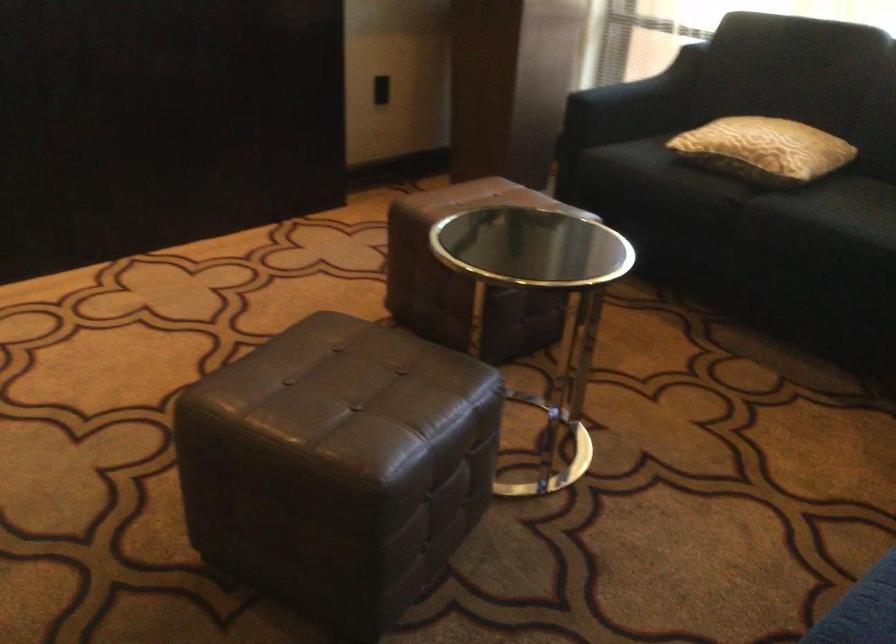
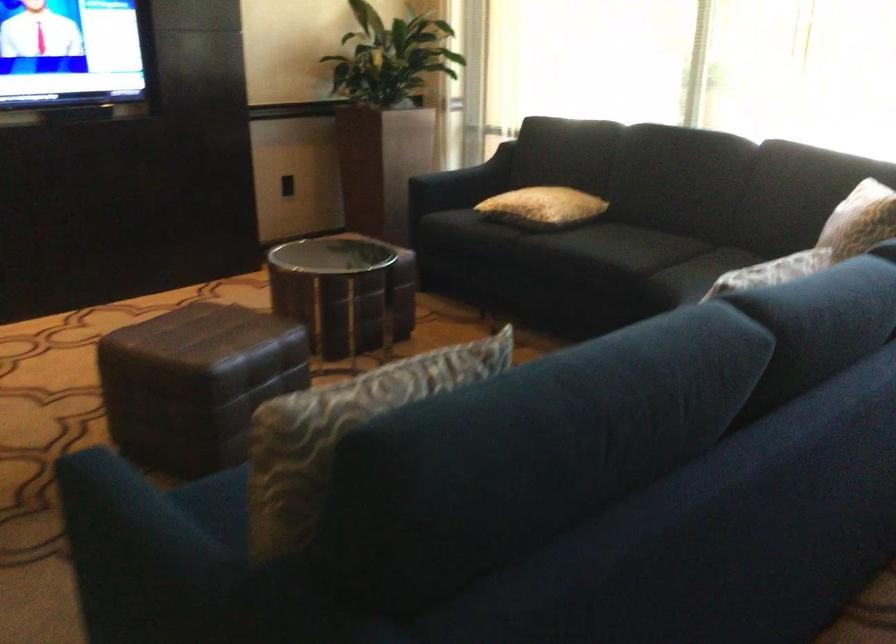
The point at (636, 106) is marked in the first image. Where is the corresponding point in the second image?

(460, 184)